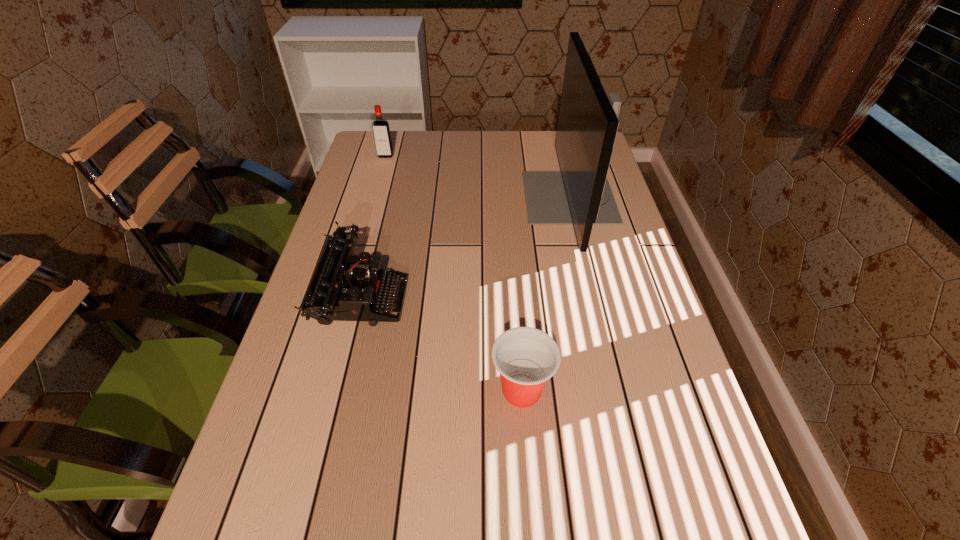
Locate an element on the screen. Image resolution: width=960 pixels, height=540 pixels. free space between the vodka and the cup is located at coordinates 453,273.

Locate an element on the screen. The width and height of the screenshot is (960, 540). vacant region between the typewriter and the computer monitor is located at coordinates [466, 248].

Find the location of a particular element. The image size is (960, 540). blank region between the tallest object and the nearest object is located at coordinates (545, 294).

Locate an element on the screen. The width and height of the screenshot is (960, 540). unoccupied area between the third shortest object and the tallest object is located at coordinates (477, 177).

Locate an element on the screen. Image resolution: width=960 pixels, height=540 pixels. vacant point located between the nearest object and the typewriter is located at coordinates click(x=443, y=345).

What are the coordinates of `vacant region between the nearest object and the third shortest object` in the screenshot? It's located at (453, 273).

The image size is (960, 540). I want to click on empty space between the nearest object and the computer monitor, so click(545, 294).

Choose which object is the second nearest neighbor to the typewriter. Please provide its 2D coordinates. Your answer should be formatted as a tuple, i.e. [(x, y)], where the tuple contains the x and y coordinates of a point satisfying the conditions above.

[(580, 195)]

Identify which object is the third nearest to the typewriter. Please provide its 2D coordinates. Your answer should be formatted as a tuple, i.e. [(x, y)], where the tuple contains the x and y coordinates of a point satisfying the conditions above.

[(382, 137)]

Identify the location of vacant region that satisfies the following two spatial constraints: 1. on the keyboard of the typewriter; 2. on the left side of the nearest object. (340, 391).